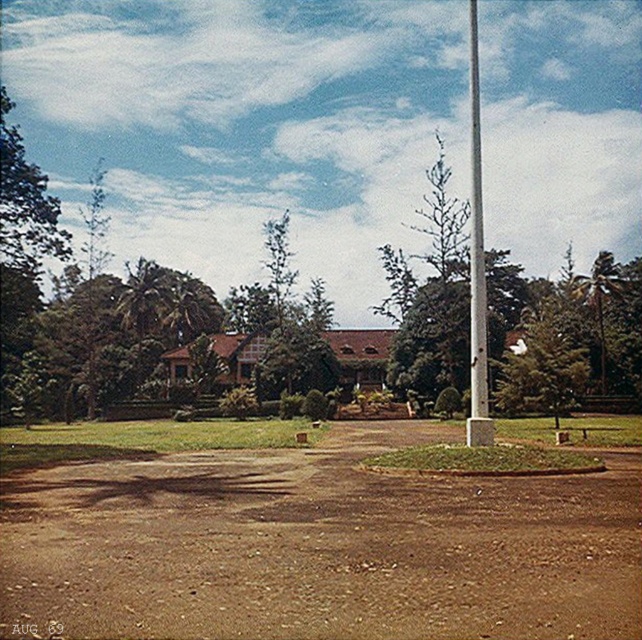
Question: Which point is closer to the camera?

Choices:
 (A) (471, 161)
 (B) (539, 301)
 (C) (100, 621)

Answer: (C)

Question: Which object is positioned closest to the green leafy tree at center?

Choices:
 (A) white glossy pole at center
 (B) brown dirt field at center

Answer: (A)

Question: Does brown dirt field at center have a lesser width compared to white glossy pole at center?

Choices:
 (A) no
 (B) yes

Answer: (B)

Question: Can you confirm if brown dirt field at center is positioned above white glossy pole at center?

Choices:
 (A) no
 (B) yes

Answer: (A)

Question: Does green leafy tree at center appear on the right side of white glossy pole at center?

Choices:
 (A) no
 (B) yes

Answer: (A)

Question: Based on their relative distances, which object is nearer to the brown dirt field at center?

Choices:
 (A) white glossy pole at center
 (B) green leafy tree at center

Answer: (A)